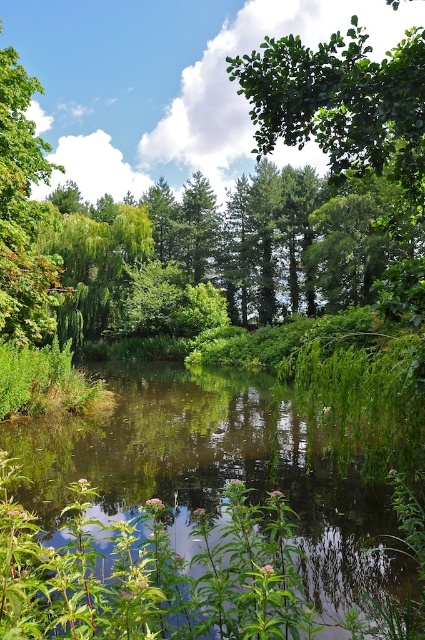
The image size is (425, 640). Describe the element at coordinates (215, 512) in the screenshot. I see `green leafy river at center` at that location.

Is green leafy river at center bigger than green leafy tree at upper center?

Incorrect, green leafy river at center is not larger than green leafy tree at upper center.

At what (x,y) coordinates should I click in order to perform the action: click on green leafy river at center. Please return your answer as a coordinate pair (x, y). The width and height of the screenshot is (425, 640). Looking at the image, I should click on (215, 512).

Who is more distant from viewer, (402, 93) or (8, 296)?

Point (8, 296)

The width and height of the screenshot is (425, 640). Find the location of `green leafy tree at upper center`. green leafy tree at upper center is located at coordinates (337, 99).

Find the location of a particular element. The image size is (425, 640). green leafy tree at upper center is located at coordinates (337, 99).

Between green leafy river at center and green leafy tree at upper left, which one appears on the right side from the viewer's perspective?

green leafy river at center is more to the right.

Is point (54, 460) in front of point (30, 256)?

Yes, point (54, 460) is in front of point (30, 256).

In order to click on green leafy river at center in this screenshot , I will do `click(215, 512)`.